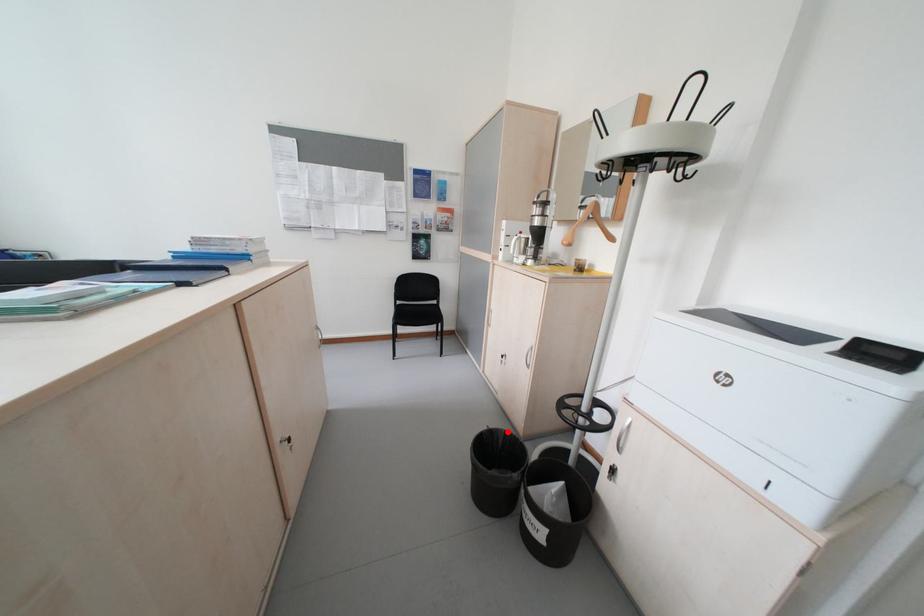
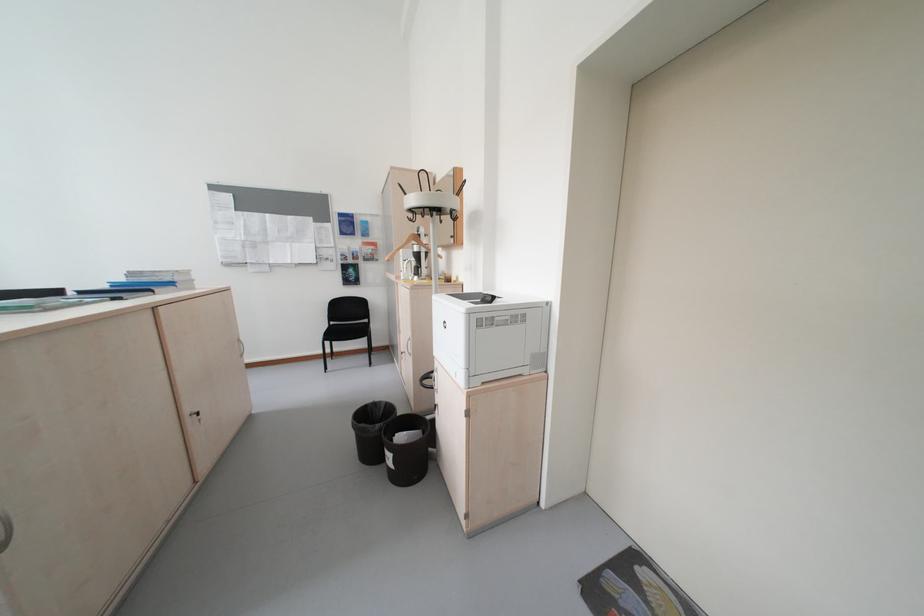
The point at the highlighted location is marked in the first image. Where is the corresponding point in the second image?

(391, 403)